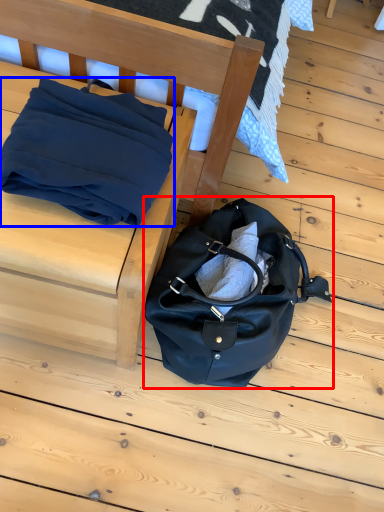
Question: Among these objects, which one is farthest to the camera, handbag (highlighted by a red box) or blanket (highlighted by a blue box)?

Choices:
 (A) handbag
 (B) blanket

Answer: (A)